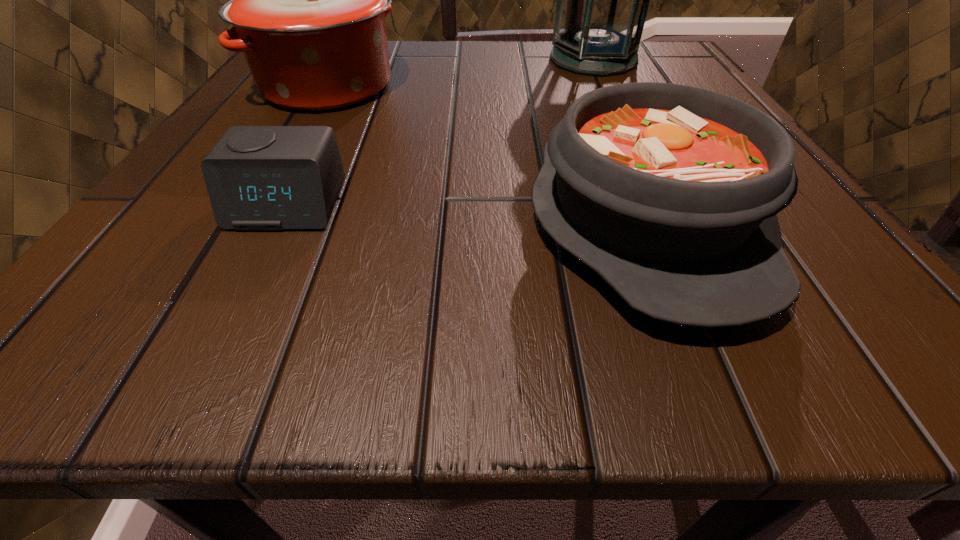
Image resolution: width=960 pixels, height=540 pixels. Identify the location of free region at the far edge of the desktop. (407, 50).

You are a GUI agent. You are given a task and a screenshot of the screen. Output one action in this format:
    pyautogui.click(x=<x>, y=<y>)
    Task: Click on the vacant space at the near edge of the desktop
    
    Given the screenshot: What is the action you would take?
    pyautogui.click(x=267, y=312)

This screenshot has width=960, height=540. In the image, there is a desktop. What are the coordinates of `free space at the left edge` in the screenshot? It's located at (193, 177).

Find the location of a particular element. free space at the right edge is located at coordinates (816, 221).

I want to click on vacant space at the far right corner of the desktop, so click(687, 86).

I want to click on free space between the nearer casserole and the farther casserole, so point(486,153).

The width and height of the screenshot is (960, 540). I want to click on free space between the shortest object and the oil lamp, so click(x=440, y=132).

Identify the location of free space that is in between the second shortest object and the left casserole. (486, 153).

The width and height of the screenshot is (960, 540). Find the location of `unoccupied area between the shorter casserole and the alarm clock`. unoccupied area between the shorter casserole and the alarm clock is located at coordinates (466, 213).

Locate an element on the screen. This screenshot has width=960, height=540. vacant space that's between the alarm clock and the oil lamp is located at coordinates (440, 132).